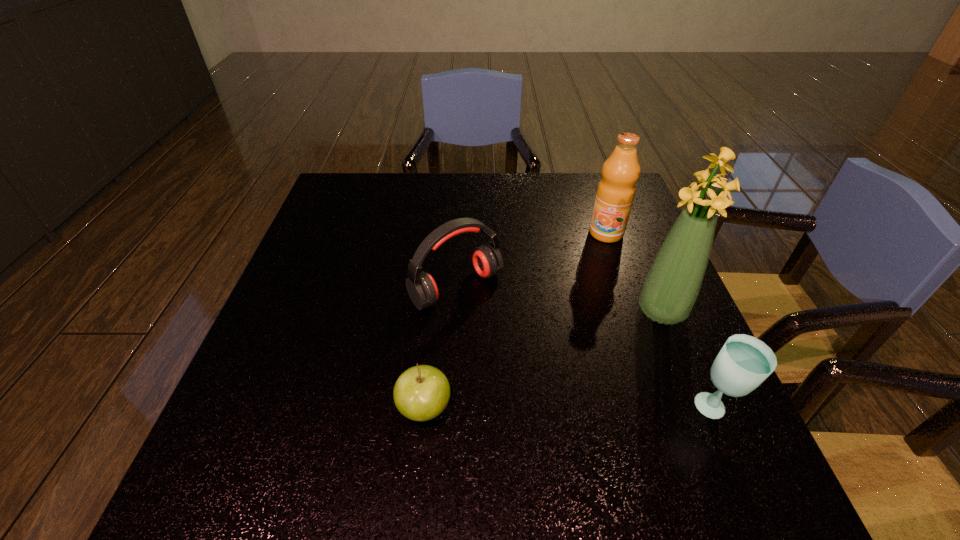
Locate an element on the screen. The height and width of the screenshot is (540, 960). the shortest object is located at coordinates (421, 393).

The width and height of the screenshot is (960, 540). What are the coordinates of `glass` in the screenshot? It's located at (744, 362).

Identify the location of the farthest object. (615, 194).

You are a GUI agent. You are given a task and a screenshot of the screen. Output one action in this format:
    pyautogui.click(x=<x>, y=<y>)
    Task: Click on the fruit juice
    Image resolution: width=960 pixels, height=540 pixels.
    Given the screenshot: What is the action you would take?
    pyautogui.click(x=615, y=194)

I want to click on bouquet, so click(671, 287).

Find the location of `earphone`. earphone is located at coordinates (487, 260).

This screenshot has width=960, height=540. Identify the location of free space located on the right of the shortest object. (651, 408).

At what (x,y) coordinates should I click in order to perform the action: click on vacant point located on the back of the glass. Please return your answer as a coordinate pair (x, y). Looking at the image, I should click on (672, 310).

The height and width of the screenshot is (540, 960). What are the coordinates of `free region located 0.390m on the front label of the fourth shortest object` in the screenshot? It's located at (560, 350).

You are a GUI agent. You are given a task and a screenshot of the screen. Output one action in this format:
    pyautogui.click(x=<x>, y=<y>)
    Task: Click on the free location located on the front label of the fourth shortest object
    
    Given the screenshot: What is the action you would take?
    pyautogui.click(x=573, y=317)